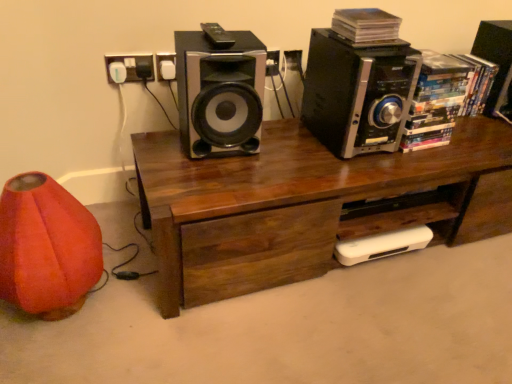
This screenshot has width=512, height=384. Find the location of `vacant area in front of black metallic speaker at upper right, which is counted as the second speaker, starting from the left`. vacant area in front of black metallic speaker at upper right, which is counted as the second speaker, starting from the left is located at coordinates (331, 167).